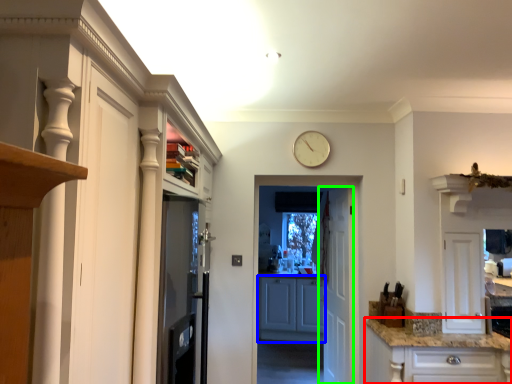
Question: Estimate the real-world distances between objects in this image. Which object is closer to cabinetry (highlighted by a red box), cabinetry (highlighted by a blue box) or door (highlighted by a green box)?

Choices:
 (A) cabinetry
 (B) door

Answer: (B)